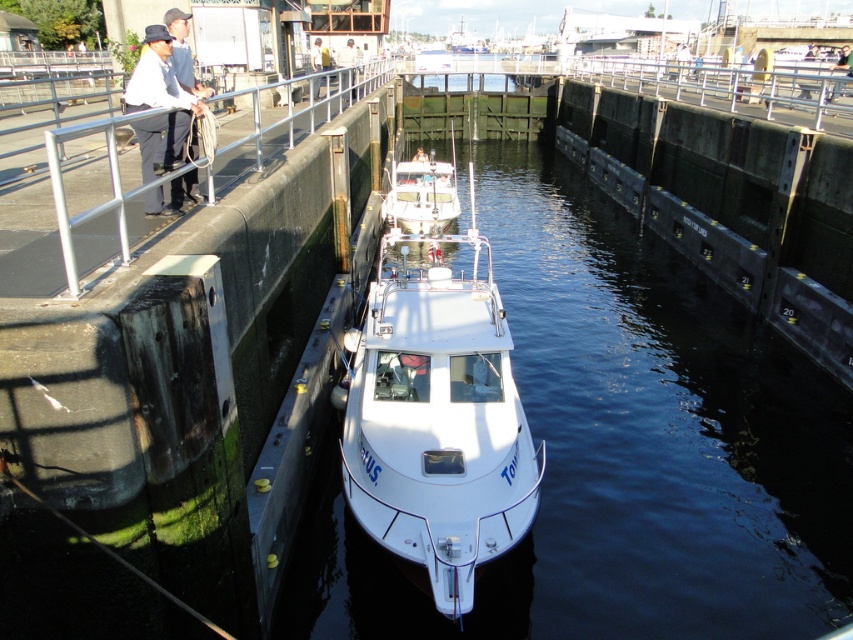
Who is positioned more to the left, white glossy water at center or white glossy boat at center?

white glossy boat at center

Is white glossy water at center to the right of white glossy boat at center from the viewer's perspective?

Yes, white glossy water at center is to the right of white glossy boat at center.

Does point (640, 392) come farther from viewer compared to point (448, 428)?

Yes, it is.

Find the location of a particular element. This screenshot has height=640, width=853. white glossy water at center is located at coordinates (619, 449).

Between matte black hat at upper left and white cotton shirt at upper left, which one has more height?

Standing taller between the two is matte black hat at upper left.

Does matte black hat at upper left have a lesser width compared to white cotton shirt at upper left?

No.

Image resolution: width=853 pixels, height=640 pixels. What do you see at coordinates (158, 106) in the screenshot?
I see `matte black hat at upper left` at bounding box center [158, 106].

Locate an element on the screen. Image resolution: width=853 pixels, height=640 pixels. matte black hat at upper left is located at coordinates (158, 106).

Is the position of white glossy boat at center more distant than that of white cotton shirt at upper left?

No, white glossy boat at center is closer to the viewer.

Which is in front, point (445, 307) or point (196, 186)?

Point (196, 186) is in front.

In order to click on white glossy boat at center in this screenshot , I will do `click(437, 416)`.